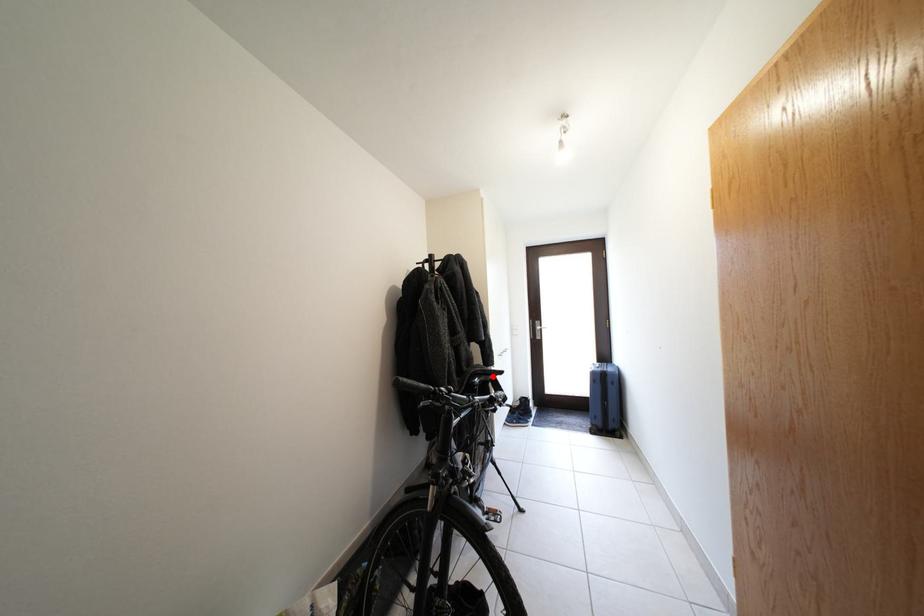
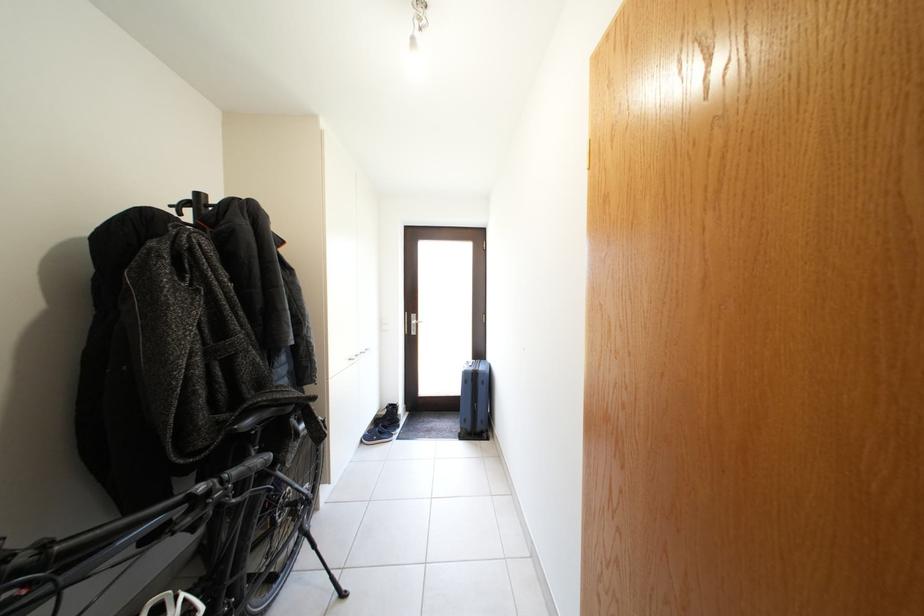
In the second image, find the point that corresponds to the highlighted location in the first image.

(286, 406)